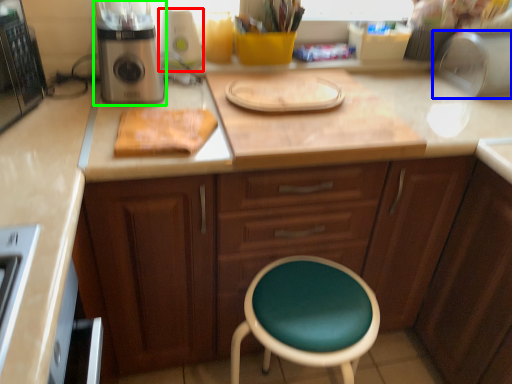
Question: Which is farther away from appliance (highlighted by a red box)? appliance (highlighted by a blue box) or kitchen appliance (highlighted by a green box)?

Choices:
 (A) appliance
 (B) kitchen appliance

Answer: (A)